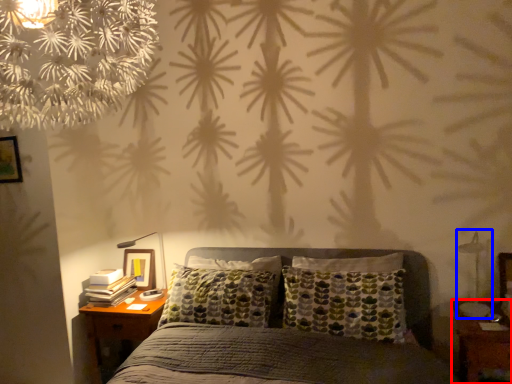
Question: Among these objects, which one is farthest to the camera, nightstand (highlighted by a red box) or bedside lamp (highlighted by a blue box)?

Choices:
 (A) nightstand
 (B) bedside lamp

Answer: (B)